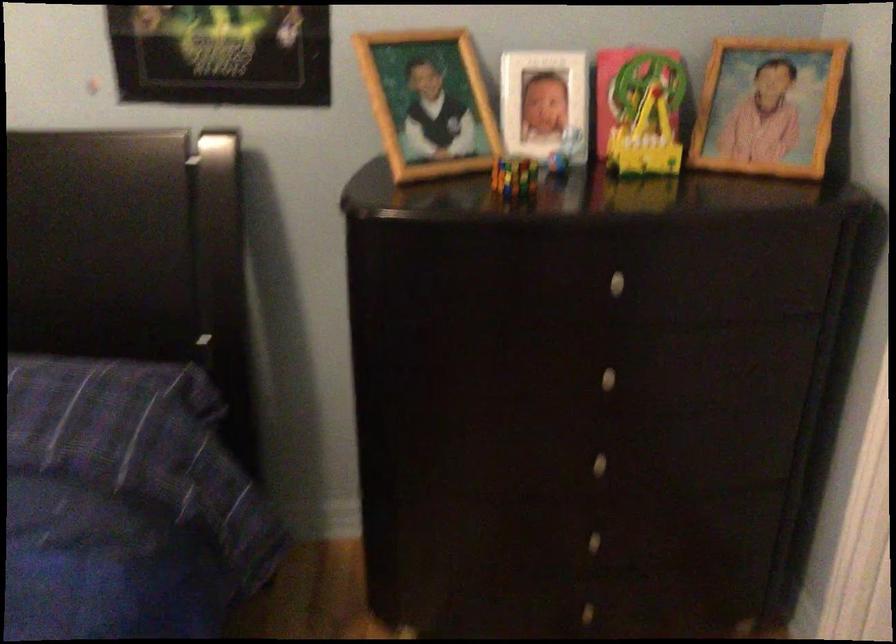
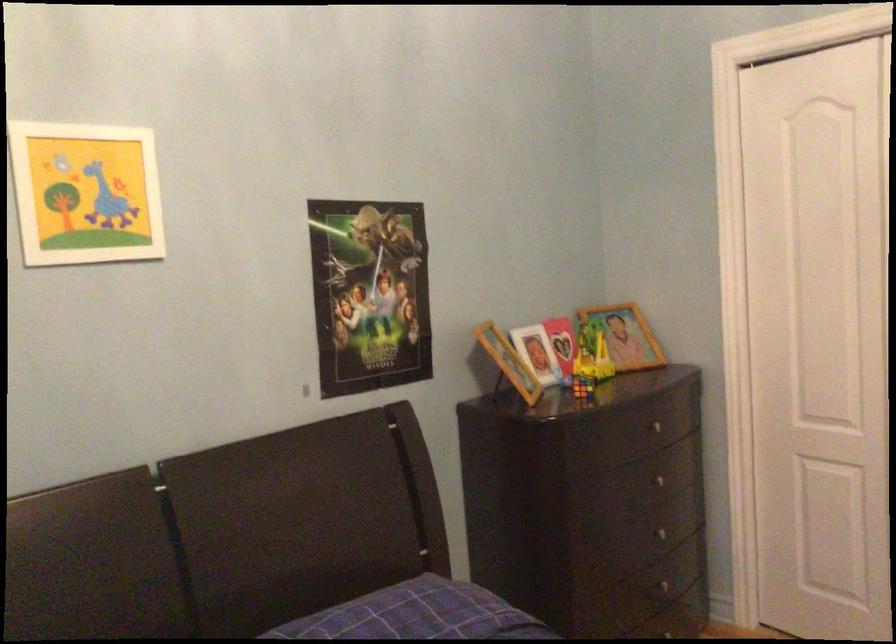
Where in the second image is the point corresponding to the point at 600,366 from the first image?

(656, 480)